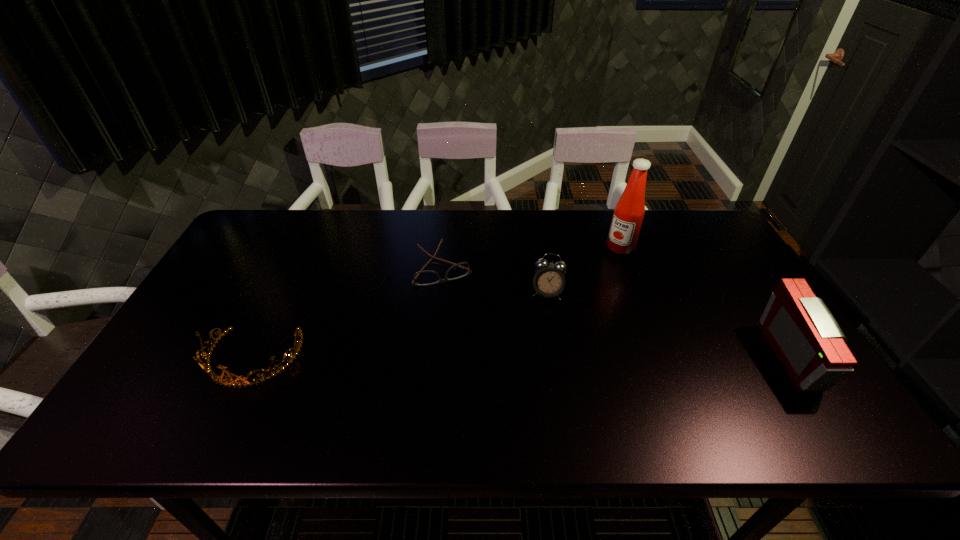
The image size is (960, 540). What are the coordinates of `condiment that is at the far edge` in the screenshot? It's located at (629, 211).

Where is `tiara at the near edge`? This screenshot has width=960, height=540. tiara at the near edge is located at coordinates (267, 374).

Where is `camera positioned at the near edge`? The width and height of the screenshot is (960, 540). camera positioned at the near edge is located at coordinates (805, 337).

Locate an element on the screen. object present at the left edge is located at coordinates 267,374.

Identify the location of object that is at the right edge. tap(805, 337).

The width and height of the screenshot is (960, 540). Find the location of `object located at the near left corner`. object located at the near left corner is located at coordinates (267, 374).

Identify the location of object that is at the near right corner. click(x=805, y=337).

Image resolution: width=960 pixels, height=540 pixels. Find the location of `vacant region at the far edge`. vacant region at the far edge is located at coordinates (413, 245).

At what (x,y) coordinates should I click in order to perform the action: click on free space at the near edge. Please return your answer as a coordinate pair (x, y). The width and height of the screenshot is (960, 540). Looking at the image, I should click on (680, 393).

Locate an element on the screen. vacant space at the right edge of the desktop is located at coordinates (705, 284).